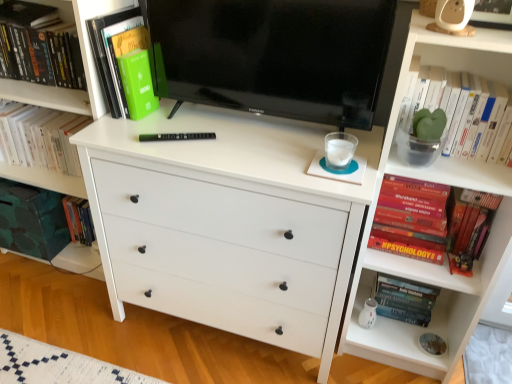
Question: Is green matte book at upper left, arranged as the fourth book when viewed from the right, completely or partially outside of green matte plant at upper right, the 1th book positioned from the right?

Choices:
 (A) no
 (B) yes

Answer: (B)

Question: From the image's perspective, is green matte book at upper left, positioned as the 2th book in left-to-right order, on green matte plant at upper right, marked as the 5th book in a left-to-right arrangement?

Choices:
 (A) no
 (B) yes

Answer: (B)

Question: From the image's perspective, is green matte book at upper left, arranged as the fourth book when viewed from the right, below green matte plant at upper right, the 1th book positioned from the right?

Choices:
 (A) no
 (B) yes

Answer: (A)

Question: Is the depth of green matte book at upper left, positioned as the 2th book in left-to-right order, less than that of green matte plant at upper right, marked as the 5th book in a left-to-right arrangement?

Choices:
 (A) yes
 (B) no

Answer: (B)

Question: Can you confirm if green matte book at upper left, arranged as the fourth book when viewed from the right, is thinner than green matte plant at upper right, the 1th book positioned from the right?

Choices:
 (A) no
 (B) yes

Answer: (B)

Question: Considering the positions of green matte plant at upper right, the 1th book positioned from the right, and white matte chest of drawers at center in the image, is green matte plant at upper right, the 1th book positioned from the right, taller or shorter than white matte chest of drawers at center?

Choices:
 (A) short
 (B) tall

Answer: (A)

Question: Is green matte plant at upper right, the 1th book positioned from the right, bigger or smaller than white matte chest of drawers at center?

Choices:
 (A) small
 (B) big

Answer: (A)

Question: Is point (426, 144) closer or farther from the camera than point (258, 236)?

Choices:
 (A) closer
 (B) farther

Answer: (A)

Question: Relative to white matte chest of drawers at center, is green matte plant at upper right, the 1th book positioned from the right, in front or behind?

Choices:
 (A) front
 (B) behind

Answer: (B)

Question: Do you think black glossy tv at center is within hardcover psychology book at lower right, which is the 3th book in left-to-right order, or outside of it?

Choices:
 (A) inside
 (B) outside

Answer: (B)

Question: Looking at their shapes, would you say black glossy tv at center is wider or thinner than hardcover psychology book at lower right, which is the 3th book in left-to-right order?

Choices:
 (A) wide
 (B) thin

Answer: (A)

Question: From the image's perspective, relative to hardcover psychology book at lower right, placed as the third book when sorted from right to left, is black glossy tv at center above or below?

Choices:
 (A) below
 (B) above

Answer: (B)

Question: In the image, is black glossy tv at center positioned in front of or behind hardcover psychology book at lower right, which is the 3th book in left-to-right order?

Choices:
 (A) behind
 (B) front

Answer: (B)

Question: Is hardcover psychology book at lower right, placed as the third book when sorted from right to left, in front of or behind black glossy tv at center in the image?

Choices:
 (A) front
 (B) behind

Answer: (B)

Question: Looking at their shapes, would you say hardcover psychology book at lower right, placed as the third book when sorted from right to left, is wider or thinner than black glossy tv at center?

Choices:
 (A) wide
 (B) thin

Answer: (B)